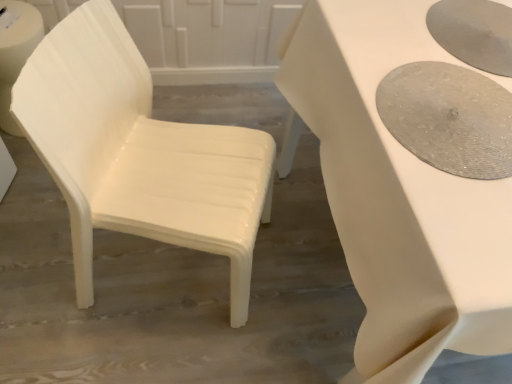
Find the location of a particular element. unoccupied space behind matte silver tray at right is located at coordinates (425, 32).